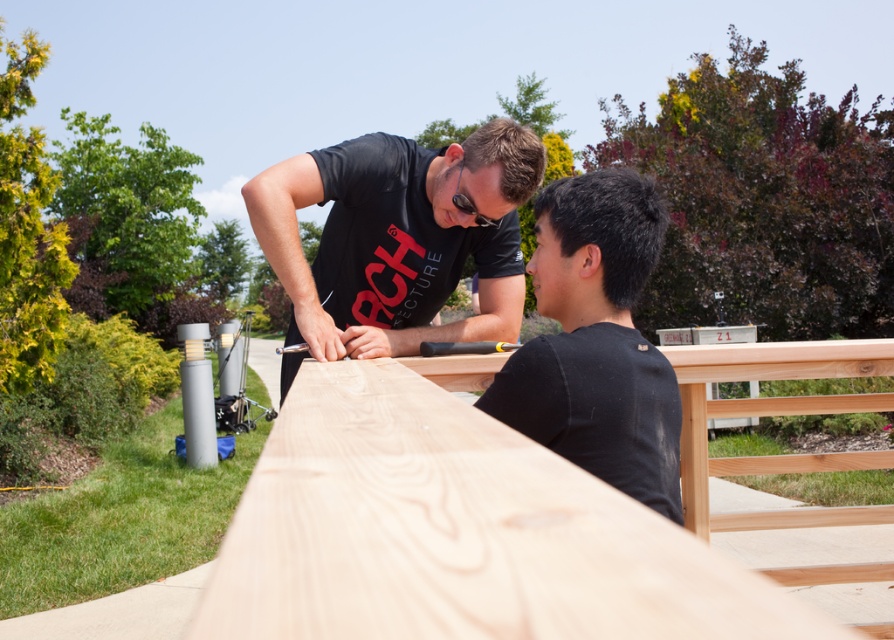
You are standing in the scene and want to reach the point at coordinates (296, 632). If your arm can reach 24 centimeters, can you touch it without moving your feet?

The point at coordinates (296, 632) is 24.44 centimeters from the camera, so yes, you can touch it with your arm since it is within reach.

You are standing at the point with coordinates point (416, 308) and want to walk to the point with coordinates point (620, 420). Given the scene described, will you be moving towards the background or the foreground?

Since point (416, 308) is behind point (620, 420), moving from point (416, 308) to point (620, 420) means you are moving towards the foreground.

You are standing 2 meters away from a point marked at coordinates point (x=402, y=301). Can you reach that point without moving your feet?

The distance of point (x=402, y=301) from viewer is 2.45 meters, so you are currently 2 meters away from it. Since the point is 0.45 meters farther away than your current position, you cannot reach it without moving your feet.